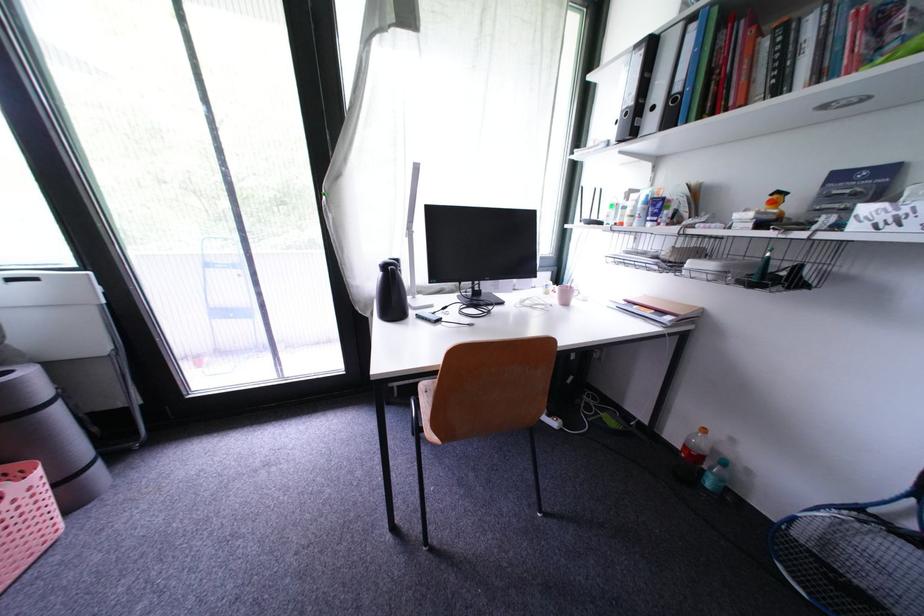
The height and width of the screenshot is (616, 924). Identify the location of white desk lamp. (411, 196).